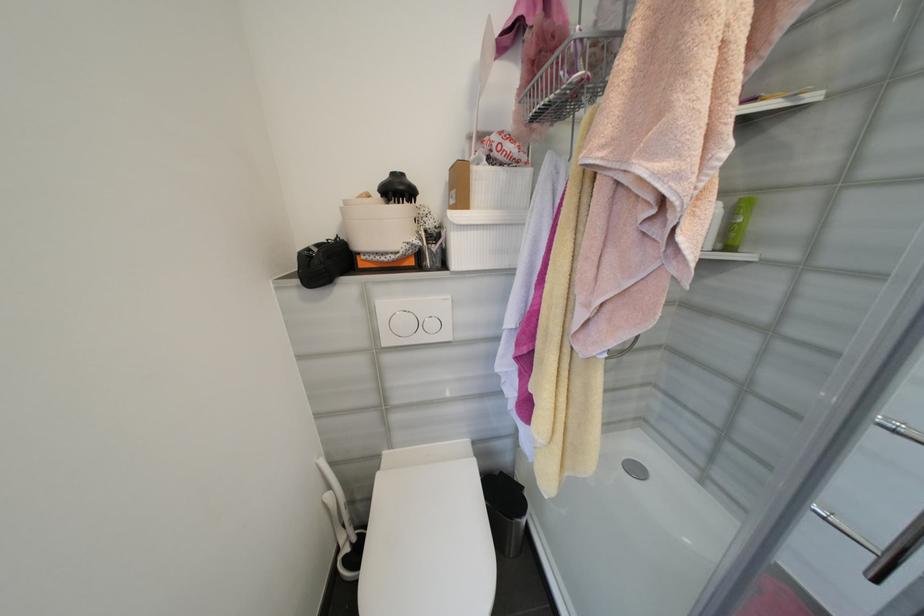
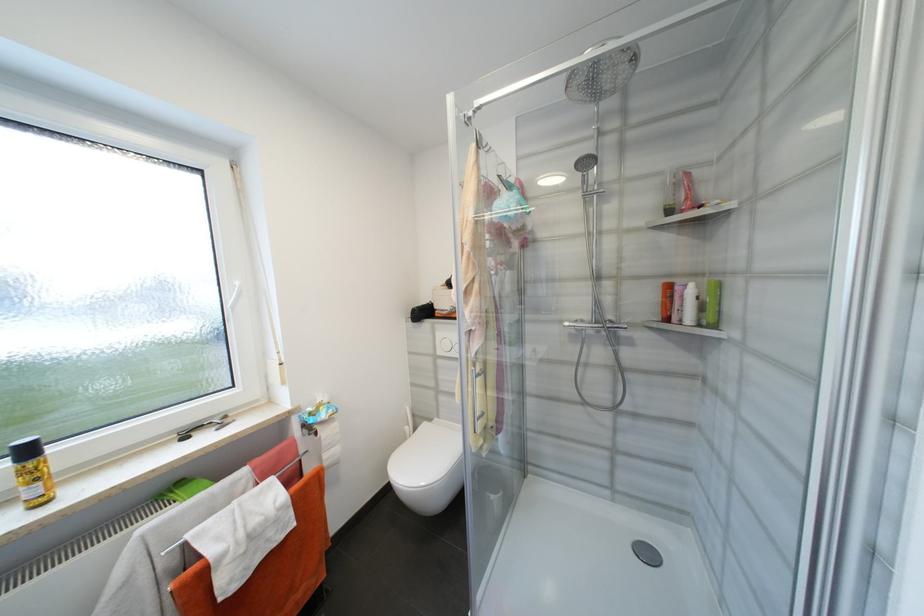
Locate, in the second image, the point that corresponds to pixel 721 246 in the first image.

(704, 322)